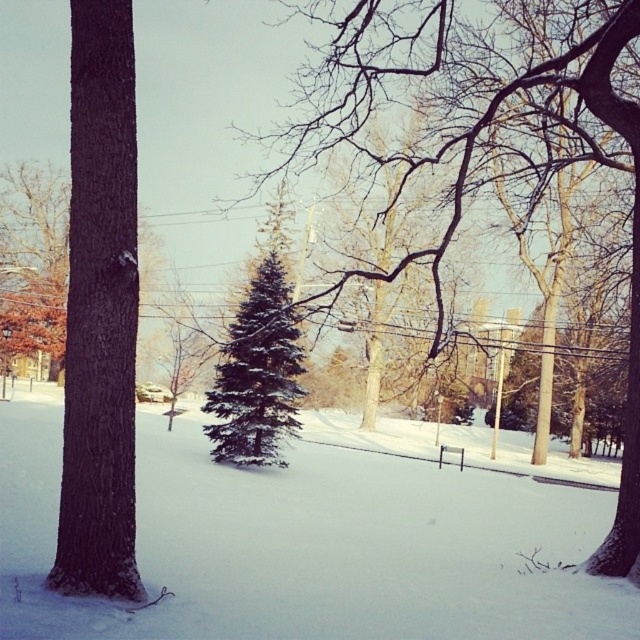
Can you confirm if white fluffy snow at center is thinner than green matte evergreen tree at center?

In fact, white fluffy snow at center might be wider than green matte evergreen tree at center.

Is white fluffy snow at center to the right of green matte evergreen tree at center from the viewer's perspective?

Incorrect, white fluffy snow at center is not on the right side of green matte evergreen tree at center.

Where is `white fluffy snow at center`? white fluffy snow at center is located at coordinates (308, 547).

Is white fluffy snow at center positioned before brown rough bark tree at left?

Yes, white fluffy snow at center is closer to the viewer.

Can you confirm if white fluffy snow at center is positioned to the right of brown rough bark tree at left?

Incorrect, white fluffy snow at center is not on the right side of brown rough bark tree at left.

The height and width of the screenshot is (640, 640). Identify the location of white fluffy snow at center. pyautogui.click(x=308, y=547).

The height and width of the screenshot is (640, 640). I want to click on white fluffy snow at center, so click(x=308, y=547).

Is point (134, 241) more distant than point (234, 448)?

No, it is not.

Can you confirm if brown rough bark tree at left is positioned below green matte evergreen tree at center?

Actually, brown rough bark tree at left is above green matte evergreen tree at center.

Which is behind, point (90, 560) or point (285, 328)?

The point (285, 328) is behind.

Locate an element on the screen. Image resolution: width=640 pixels, height=640 pixels. brown rough bark tree at left is located at coordinates (99, 310).